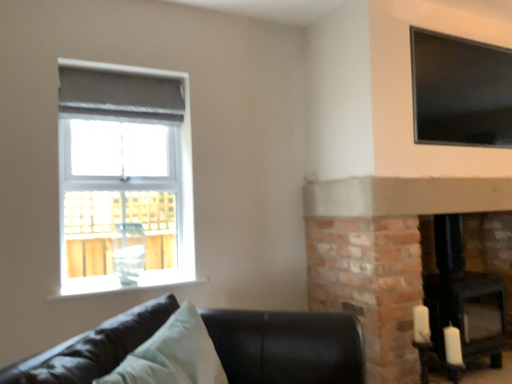
Question: From the image's perspective, relative to transparent glass window at upper right, the first window in the right-to-left sequence, is black matte fireplace at lower right above or below?

Choices:
 (A) below
 (B) above

Answer: (A)

Question: In terms of size, does black matte fireplace at lower right appear bigger or smaller than transparent glass window at upper right, the first window in the right-to-left sequence?

Choices:
 (A) small
 (B) big

Answer: (B)

Question: Considering the real-world distances, which object is farthest from the matte gray roller blind at upper left, which is the 2th window in right-to-left order?

Choices:
 (A) transparent glass window at upper right, the first window in the right-to-left sequence
 (B) black leather couch at lower left
 (C) black matte fireplace at lower right
 (D) light blue fabric pillow at lower left

Answer: (C)

Question: Which object is the farthest from the transparent glass window at upper right, marked as the second window in a left-to-right arrangement?

Choices:
 (A) light blue fabric pillow at lower left
 (B) black leather couch at lower left
 (C) matte gray roller blind at upper left, which is the 2th window in right-to-left order
 (D) black matte fireplace at lower right

Answer: (A)